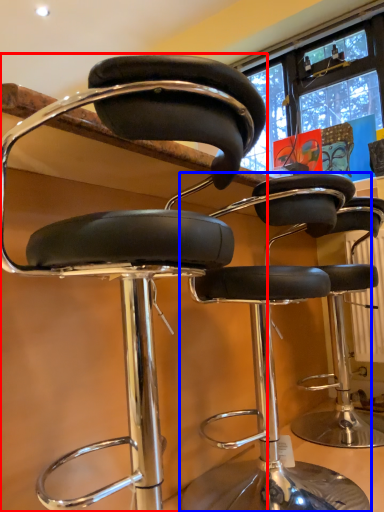
Question: Which object is further to the camera taking this photo, chair (highlighted by a red box) or chair (highlighted by a blue box)?

Choices:
 (A) chair
 (B) chair

Answer: (B)